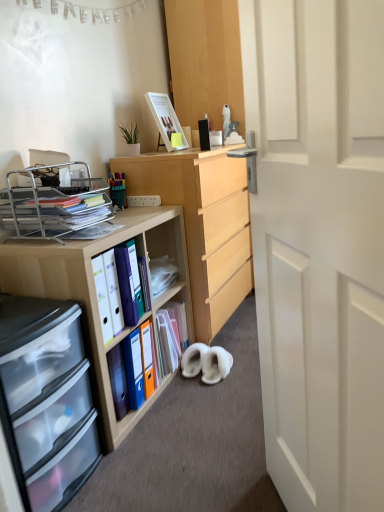
You are a GUI agent. You are given a task and a screenshot of the screen. Output one action in this format:
    pyautogui.click(x=<x>, y=<y>)
    Task: Click on the vacant area situated below white fluffy slippers at lower center, positioned as the 1th footwear in right-to-left order (from a real-world perspective)
    The image size is (384, 512).
    Given the screenshot: What is the action you would take?
    pyautogui.click(x=215, y=375)